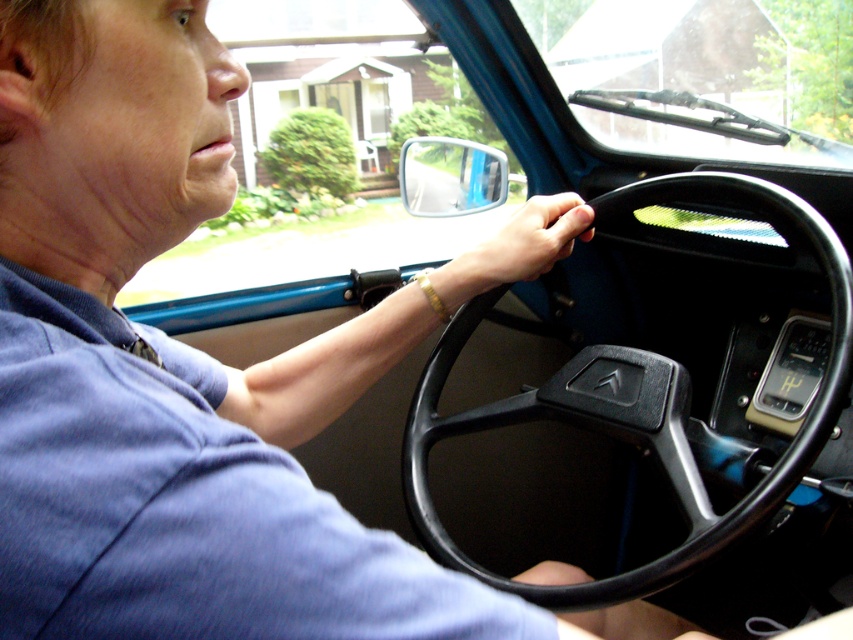
Consider the image. You are a mechanic trying to adjust the distance between the black plastic steering wheel at center and the black rubber hand at center to meet safety standards. The required distance is 9 inches. Based on the current image, is the distance sufficient?

The black plastic steering wheel at center and black rubber hand at center are currently 8.76 inches apart, which is less than the required 9 inches. Therefore, the distance is not sufficient and needs adjustment.

You are a delivery person who needs to place a small package on the dashboard. The package is 1.0 meters long. Can you fit it between the gold bracelet at center and the camera without bending it?

The distance between the gold bracelet at center and the camera is 1.03 meters, so yes, the package can be placed there as it is slightly longer than the space available.

Consider the image. You are a mechanic inspecting the driver side of a car. You notice the black plastic steering wheel at center and the black rubber hand at center. Which object takes up more space in the driver side view?

The black plastic steering wheel at center has a larger size compared to the black rubber hand at center, so it takes up more space in the driver side view.